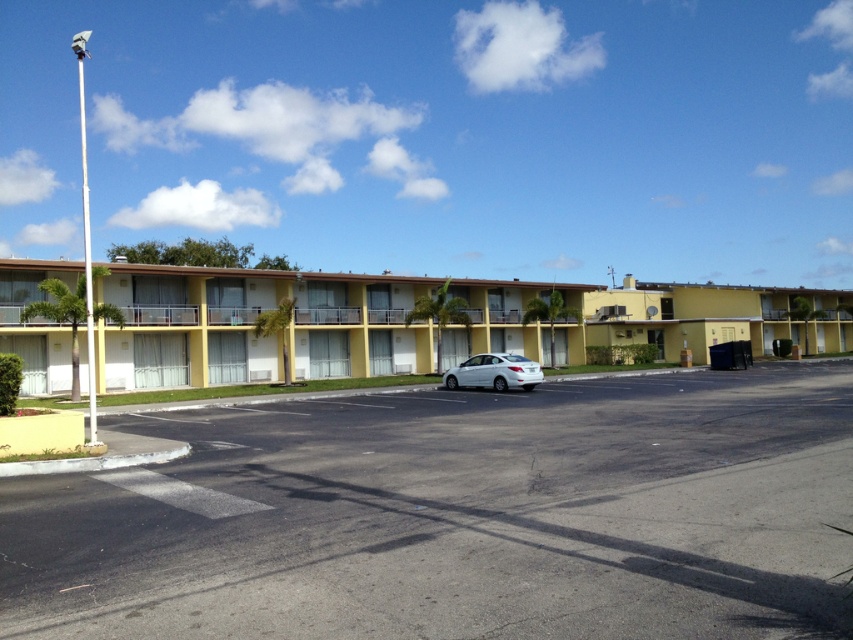
You are standing at point A, which is at coordinate 0.3, 0.3. You want to go to the yellow matte building at center. Which direction should you move? North, South, East, or West?

Since the yellow matte building at center is located at point [252,323] and you are at [254,192], you should move East to reach it.

You are standing at the entrance of the residential building and want to park your car in the black asphalt parking lot at center. What is the exact coordinate where you should position your car to park correctly?

The black asphalt parking lot at center is located at coordinate point (457, 516), so you should position your car at that exact coordinate to park correctly.